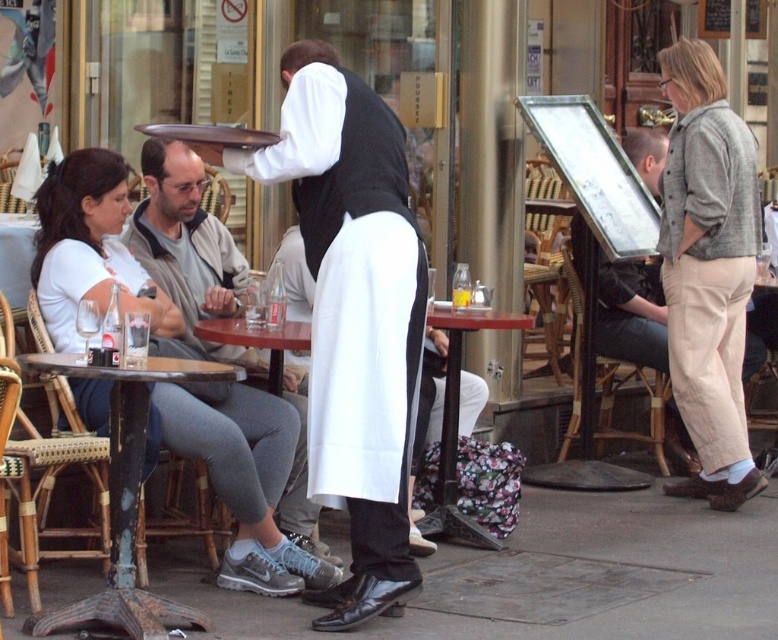
Question: Can you confirm if rustic wood table at lower left is positioned below translucent glass at table center?

Choices:
 (A) yes
 (B) no

Answer: (A)

Question: From the image, what is the correct spatial relationship of light gray linen pants at lower right in relation to rustic wood table at lower left?

Choices:
 (A) below
 (B) above

Answer: (B)

Question: Which object is closer to the camera taking this photo?

Choices:
 (A) white matte vest at center
 (B) rustic wood table at lower left
 (C) wooden table at center
 (D) matte gray jacket at left

Answer: (B)

Question: Does wooden table at center come in front of translucent glass at table center?

Choices:
 (A) no
 (B) yes

Answer: (B)

Question: Estimate the real-world distances between objects in this image. Which object is farther from the white matte vest at center?

Choices:
 (A) wooden table at center
 (B) translucent glass at table center
 (C) matte gray jacket at left

Answer: (B)

Question: Which object appears farthest from the camera in this image?

Choices:
 (A) white matte vest at center
 (B) light gray linen pants at lower right
 (C) matte gray jacket at left
 (D) rustic wood table at lower left

Answer: (B)